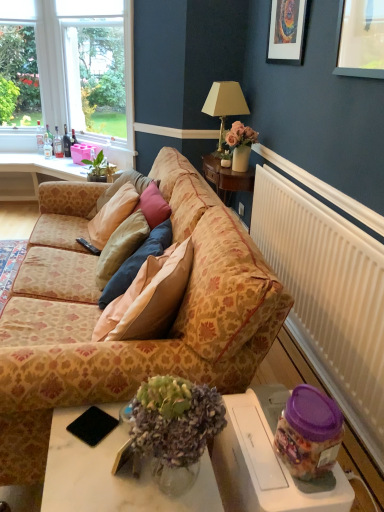
The width and height of the screenshot is (384, 512). What are the coordinates of `free space to the left of black matte pad at lower left` in the screenshot? It's located at (62, 423).